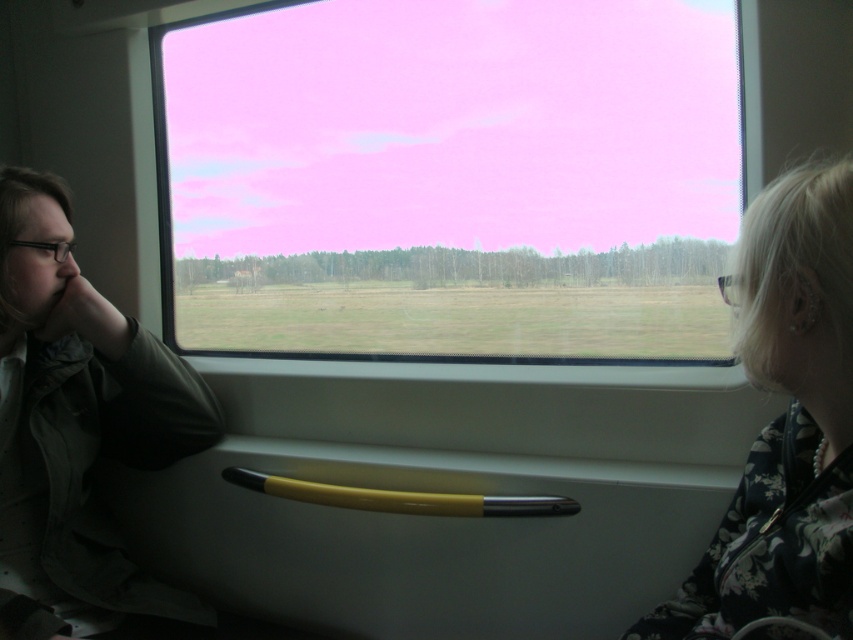
Question: Can you confirm if matte green jacket at left is wider than floral fabric jacket at right?

Choices:
 (A) yes
 (B) no

Answer: (A)

Question: Does matte green jacket at left have a smaller size compared to floral fabric jacket at right?

Choices:
 (A) no
 (B) yes

Answer: (A)

Question: Which object is farther from the camera taking this photo?

Choices:
 (A) transparent glass window at center
 (B) matte green jacket at left

Answer: (A)

Question: Can you confirm if transparent glass window at center is positioned above matte green jacket at left?

Choices:
 (A) no
 (B) yes

Answer: (B)

Question: Which object is farther from the camera taking this photo?

Choices:
 (A) matte green jacket at left
 (B) transparent glass window at center

Answer: (B)

Question: Which point appears farthest from the camera in this image?

Choices:
 (A) (376, 330)
 (B) (798, 442)

Answer: (A)